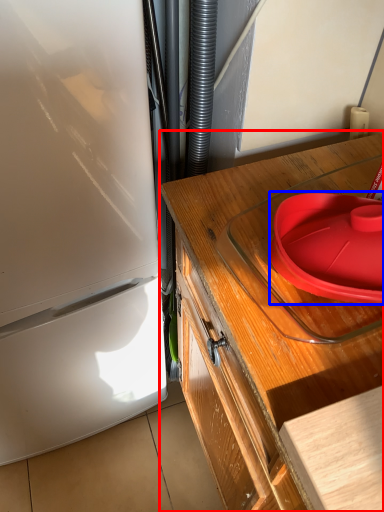
Question: Which object is closer to the camera taking this photo, countertop (highlighted by a red box) or plate (highlighted by a blue box)?

Choices:
 (A) countertop
 (B) plate

Answer: (A)